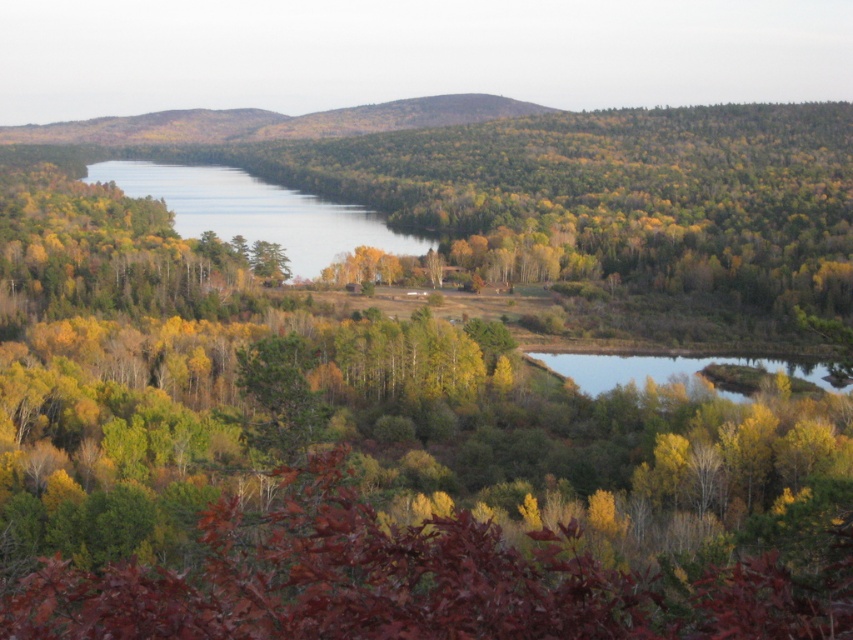
Which is above, clear water at center or clear water at bottom right?

Positioned higher is clear water at center.

I want to click on clear water at center, so click(x=258, y=211).

The width and height of the screenshot is (853, 640). Identify the location of clear water at center. (258, 211).

Image resolution: width=853 pixels, height=640 pixels. Identify the location of clear water at center. (258, 211).